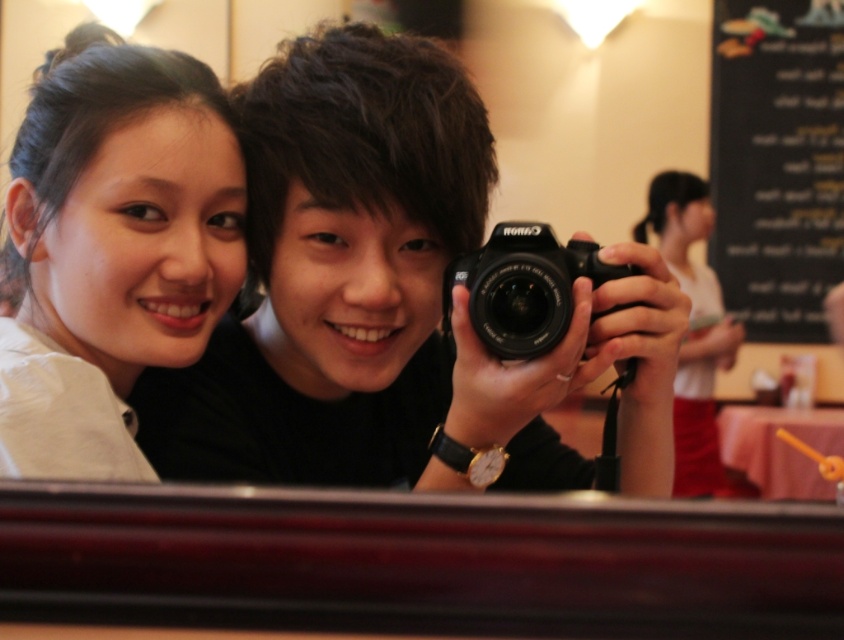
The width and height of the screenshot is (844, 640). Identify the location of black matte camera at center. (355, 205).

Can you confirm if black matte camera at center is wider than black chalkboard menu at upper right?

Incorrect, black matte camera at center's width does not surpass black chalkboard menu at upper right's.

This screenshot has height=640, width=844. Identify the location of black matte camera at center. (355, 205).

You are a GUI agent. You are given a task and a screenshot of the screen. Output one action in this format:
    pyautogui.click(x=<x>, y=<y>)
    Task: Click on the black matte camera at center
    The image size is (844, 640).
    Given the screenshot: What is the action you would take?
    pyautogui.click(x=355, y=205)

Between point (69, 467) and point (657, 182), which one is positioned behind?

Point (657, 182)

Looking at this image, does matte white shirt at left lie in front of white matte shirt at upper right?

Yes.

In order to click on matte white shirt at left in this screenshot , I will do `click(111, 248)`.

Is matte white shirt at left closer to the viewer compared to black chalkboard menu at upper right?

Yes.

Between matte white shirt at left and black chalkboard menu at upper right, which one has more height?

black chalkboard menu at upper right

Which is in front, point (164, 122) or point (805, 52)?

Positioned in front is point (164, 122).

Where is `matte white shirt at left`? The width and height of the screenshot is (844, 640). matte white shirt at left is located at coordinates (111, 248).